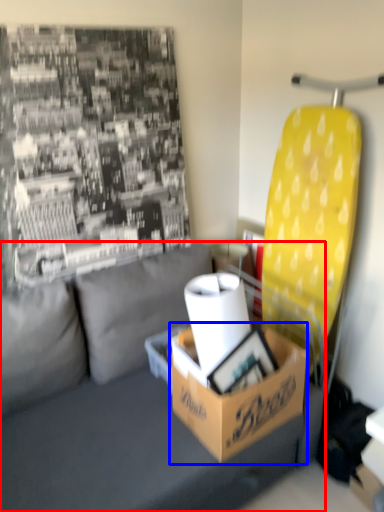
Question: Which object is further to the camera taking this photo, studio couch (highlighted by a red box) or box (highlighted by a blue box)?

Choices:
 (A) studio couch
 (B) box

Answer: (B)